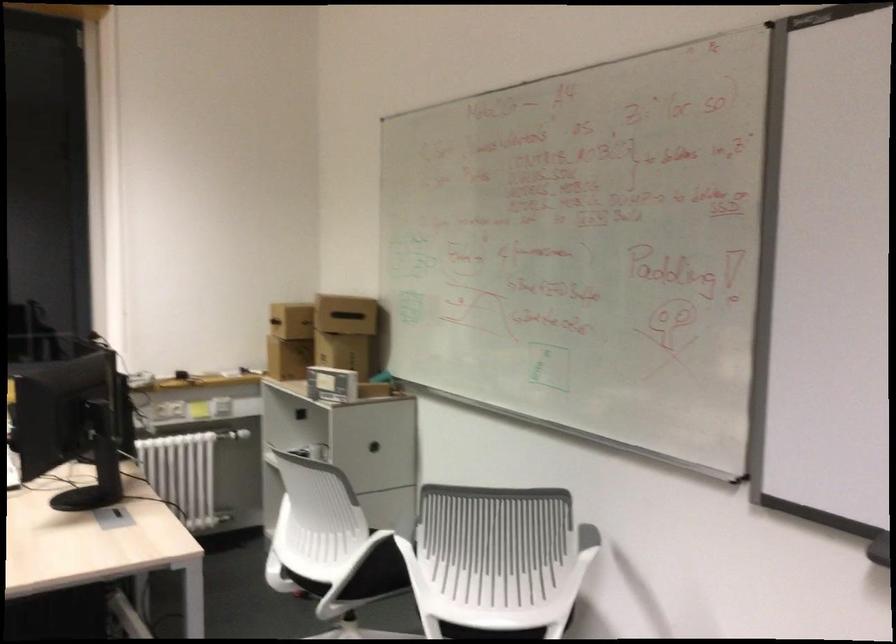
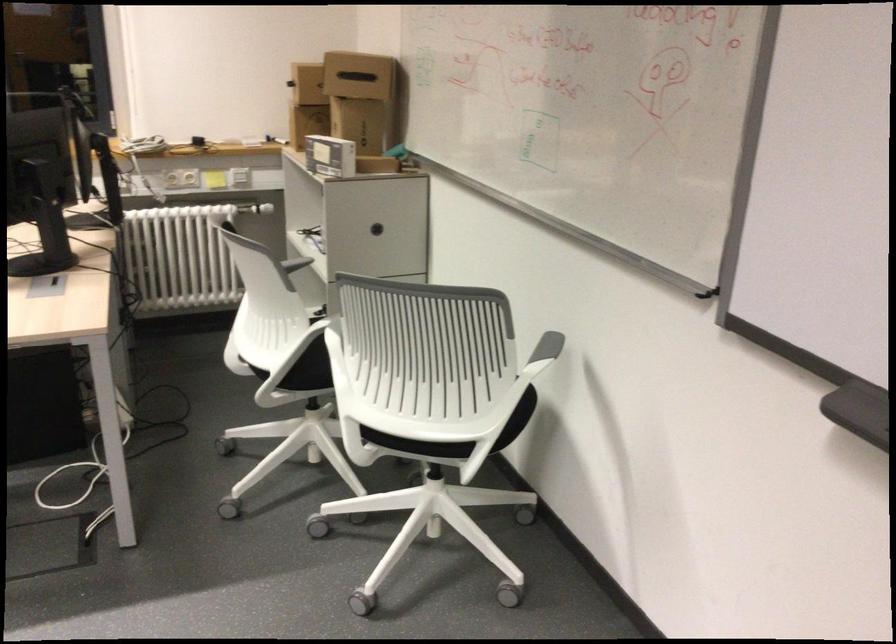
In the second image, find the point that corresponds to point 342,314 in the first image.

(357, 76)